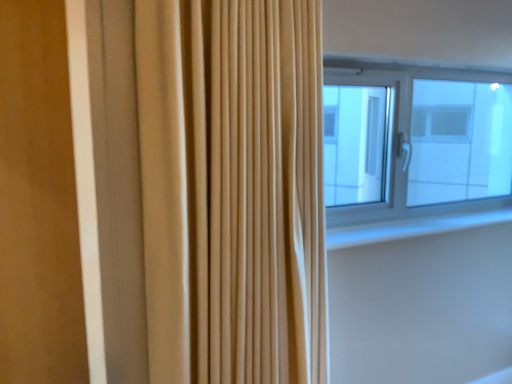
Question: From a real-world perspective, is transparent glass window at upper right above or below beige fabric curtain at center?

Choices:
 (A) below
 (B) above

Answer: (B)

Question: Based on their positions, is transparent glass window at upper right located to the left or right of beige fabric curtain at center?

Choices:
 (A) right
 (B) left

Answer: (A)

Question: Estimate the real-world distances between objects in this image. Which object is farther from the beige fabric curtain at center?

Choices:
 (A) white smooth window sill at upper right
 (B) transparent glass window at upper right

Answer: (B)

Question: Which object is the closest to the beige fabric curtain at center?

Choices:
 (A) white smooth window sill at upper right
 (B) transparent glass window at upper right

Answer: (A)